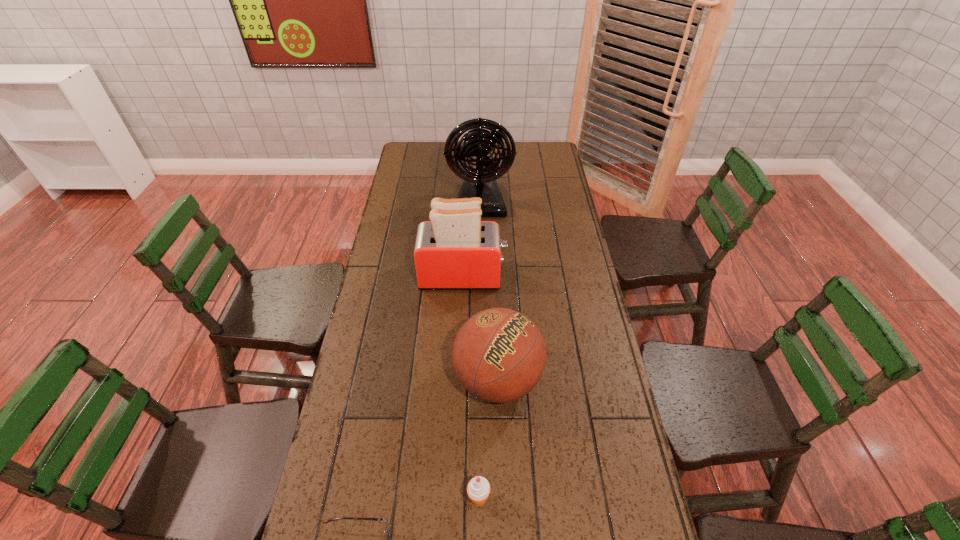
This screenshot has height=540, width=960. Identify the location of vacant space located 0.150m on the right of the third shortest object. (592, 380).

Find the location of `vacant space situated on the right of the second shortest object`. vacant space situated on the right of the second shortest object is located at coordinates (603, 499).

In the image, there is a desktop. Where is `vacant space at the left edge`? This screenshot has width=960, height=540. vacant space at the left edge is located at coordinates (407, 214).

In the image, there is a desktop. Where is `vacant area at the right edge`? vacant area at the right edge is located at coordinates (594, 295).

In the image, there is a desktop. Where is `free space at the far left corner`? The image size is (960, 540). free space at the far left corner is located at coordinates (404, 148).

The width and height of the screenshot is (960, 540). I want to click on blank area at the far right corner, so click(x=559, y=163).

Locate an element on the screen. The height and width of the screenshot is (540, 960). free space that is in between the basketball and the fan is located at coordinates (489, 291).

This screenshot has height=540, width=960. I want to click on free space between the tallest object and the third farthest object, so click(489, 291).

Select which object is the fourth closest to the shortest object. Please provide its 2D coordinates. Your answer should be formatted as a tuple, i.e. [(x, y)], where the tuple contains the x and y coordinates of a point satisfying the conditions above.

[(480, 142)]

Locate which object is the fourth closest to the icecream. Please provide its 2D coordinates. Your answer should be formatted as a tuple, i.e. [(x, y)], where the tuple contains the x and y coordinates of a point satisfying the conditions above.

[(480, 142)]